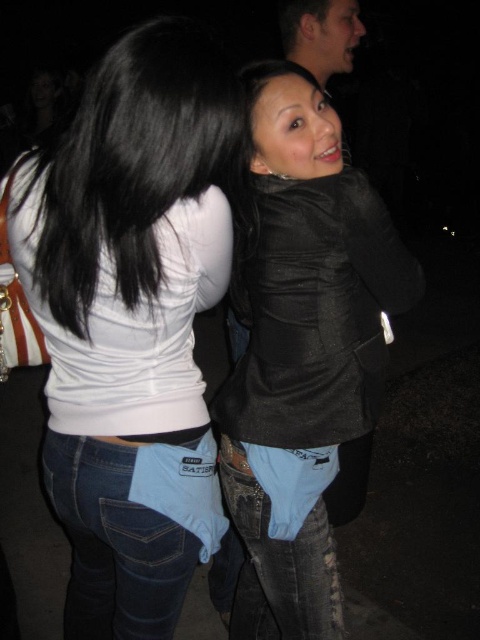
In the scene shown: You are a photographer adjusting the lighting for a nighttime portrait. You need to ensure that the white matte tank top at upper left is well lit. Where should you place the light source relative to the camera to best illuminate this area?

To best illuminate the white matte tank top at upper left, position the light source slightly to the left of the camera, aiming towards the coordinates where the tank top is located at point (131,317).

You are a fashion designer observing two people in an evening setting. The first person is wearing a white matte tank top at upper left, and the second is wearing a black leather jacket at center. Which clothing item is shorter in length?

The white matte tank top at upper left is shorter than the black leather jacket at center.